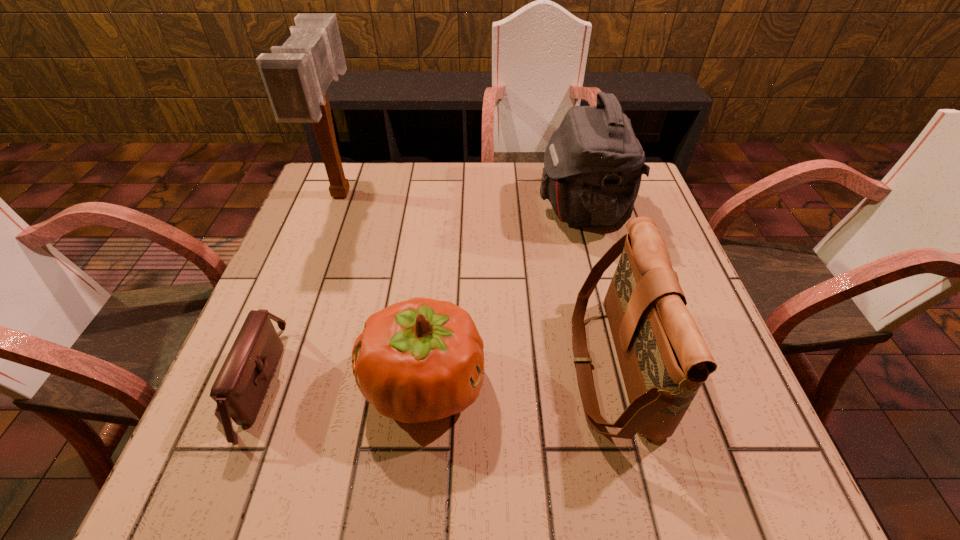
The width and height of the screenshot is (960, 540). I want to click on free space between the tallest object and the second tallest shoulder bag, so click(477, 279).

Find the location of a particular element. Image resolution: width=960 pixels, height=540 pixels. vacant space in between the second shortest shoulder bag and the tallest object is located at coordinates (477, 279).

Where is `empty space between the third shortest object and the fourth shortest object`? This screenshot has height=540, width=960. empty space between the third shortest object and the fourth shortest object is located at coordinates (597, 287).

Image resolution: width=960 pixels, height=540 pixels. I want to click on free area in between the farthest shoulder bag and the third shortest object, so click(x=597, y=287).

This screenshot has width=960, height=540. I want to click on free space between the shortest object and the fourth tallest object, so click(x=339, y=384).

You are a GUI agent. You are given a task and a screenshot of the screen. Output one action in this format:
    pyautogui.click(x=<x>, y=<y>)
    Task: Click on the free point between the mallet and the shortest object
    Image resolution: width=960 pixels, height=540 pixels.
    Given the screenshot: What is the action you would take?
    pyautogui.click(x=298, y=289)

Find the location of `blank region between the second shortest shoulder bag and the fourth tallest object`. blank region between the second shortest shoulder bag and the fourth tallest object is located at coordinates (518, 375).

You are a GUI agent. You are given a task and a screenshot of the screen. Output one action in this format:
    pyautogui.click(x=<x>, y=<y>)
    Task: Click on the free spot between the third tallest object and the tallest object
    
    Given the screenshot: What is the action you would take?
    pyautogui.click(x=477, y=279)

Identify which object is located as the third nearest to the pumpkin. Please provide its 2D coordinates. Your answer should be formatted as a tuple, i.e. [(x, y)], where the tuple contains the x and y coordinates of a point satisfying the conditions above.

[(593, 164)]

Find the location of a particular element. The height and width of the screenshot is (540, 960). object that can be found as the second closest to the tallest object is located at coordinates (420, 360).